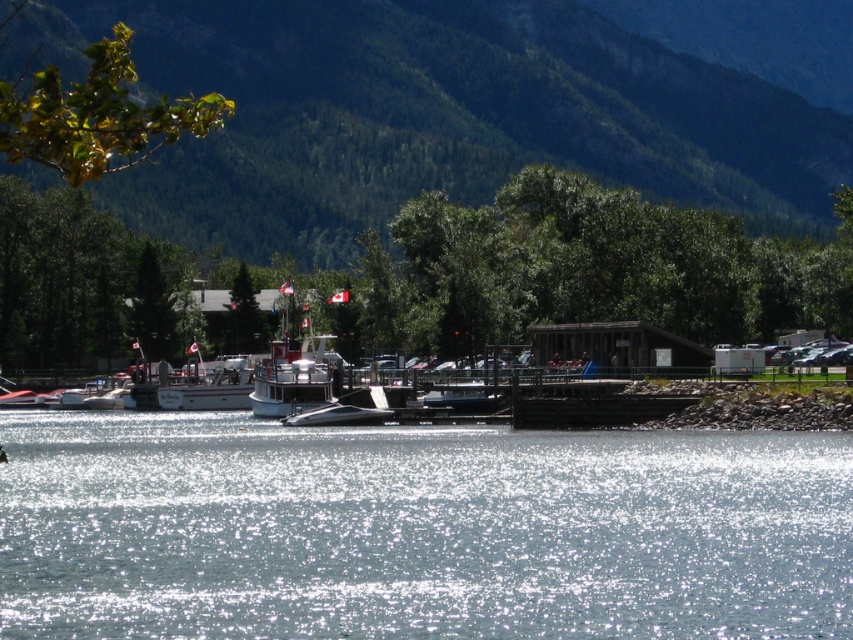
Is green leafy tree at center to the right of white glossy boat at center from the viewer's perspective?

Indeed, green leafy tree at center is positioned on the right side of white glossy boat at center.

Does green leafy tree at center appear over white glossy boat at center?

Correct, green leafy tree at center is located above white glossy boat at center.

Who is more distant from viewer, (381, 326) or (209, 406)?

The point (381, 326) is behind.

This screenshot has height=640, width=853. I want to click on green leafy tree at center, so click(x=585, y=269).

Is green forested mountain at upper center further to camera compared to green leafy tree at center?

A: That is True.

Does green forested mountain at upper center have a lesser height compared to green leafy tree at center?

Incorrect, green forested mountain at upper center's height does not fall short of green leafy tree at center's.

Does point (712, 120) come behind point (381, 310)?

Yes, point (712, 120) is farther from viewer.

The width and height of the screenshot is (853, 640). In order to click on green forested mountain at upper center in this screenshot , I will do `click(432, 115)`.

Does green leafy tree at upper left have a lesser width compared to white glossy boat at center?

In fact, green leafy tree at upper left might be wider than white glossy boat at center.

Between green leafy tree at upper left and white glossy boat at center, which one has less height?

With less height is white glossy boat at center.

What do you see at coordinates (97, 115) in the screenshot?
I see `green leafy tree at upper left` at bounding box center [97, 115].

Where is `green leafy tree at upper left`? green leafy tree at upper left is located at coordinates (97, 115).